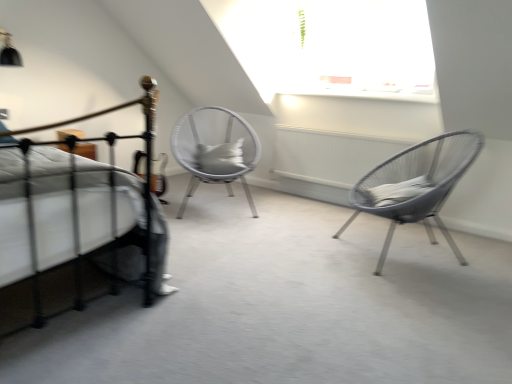
Question: From a real-world perspective, is gray fabric pillow at center positioned above or below black metal bed at left?

Choices:
 (A) above
 (B) below

Answer: (A)

Question: Is point (234, 142) positioned closer to the camera than point (138, 187)?

Choices:
 (A) farther
 (B) closer

Answer: (A)

Question: Which object is positioned closest to the gray fabric pillow at center?

Choices:
 (A) black metal bed at left
 (B) metallic wire chair at right, the first chair in the front-to-back sequence
 (C) white woven chair at center, acting as the 2th chair starting from the front

Answer: (C)

Question: Based on their relative distances, which object is farther from the metallic wire chair at right, the 2th chair in the back-to-front sequence?

Choices:
 (A) gray fabric pillow at center
 (B) white woven chair at center, the first chair from the back
 (C) black metal bed at left

Answer: (C)